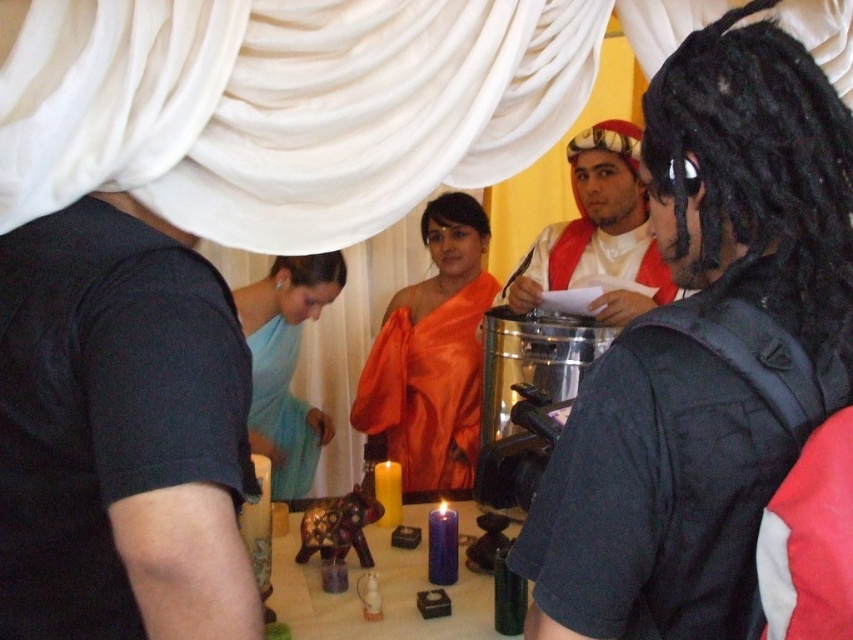
Between matte red fabric at center and light blue silk dress at center, which one is positioned higher?

matte red fabric at center

Between point (619, 288) and point (291, 352), which one is positioned in front?

Point (619, 288) is in front.

The image size is (853, 640). Identify the location of matte red fabric at center. (599, 232).

Is point (257, 620) closer to camera compared to point (294, 472)?

Yes.

Locate an element on the screen. This screenshot has width=853, height=640. black cotton t-shirt at left is located at coordinates (112, 422).

Where is `black cotton t-shirt at left`? This screenshot has height=640, width=853. black cotton t-shirt at left is located at coordinates (112, 422).

Does point (654, 566) come closer to viewer compared to point (531, 276)?

Yes, it is in front of point (531, 276).

Between black fabric robe at right and white silk robe at center, which one appears on the left side from the viewer's perspective?

Positioned to the left is black fabric robe at right.

Where is `black fabric robe at right`? black fabric robe at right is located at coordinates (676, 465).